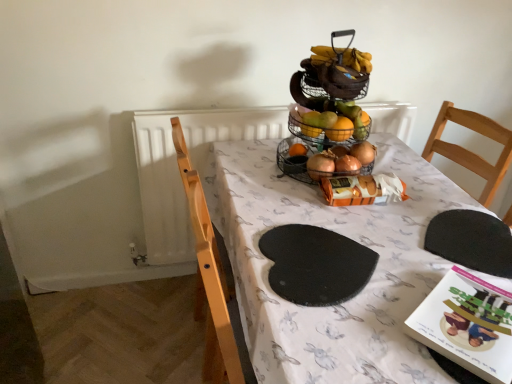
Locate an element on the screen. The image size is (512, 384). vacant area on top of white fabric table at center (from a real-world perspective) is located at coordinates (352, 232).